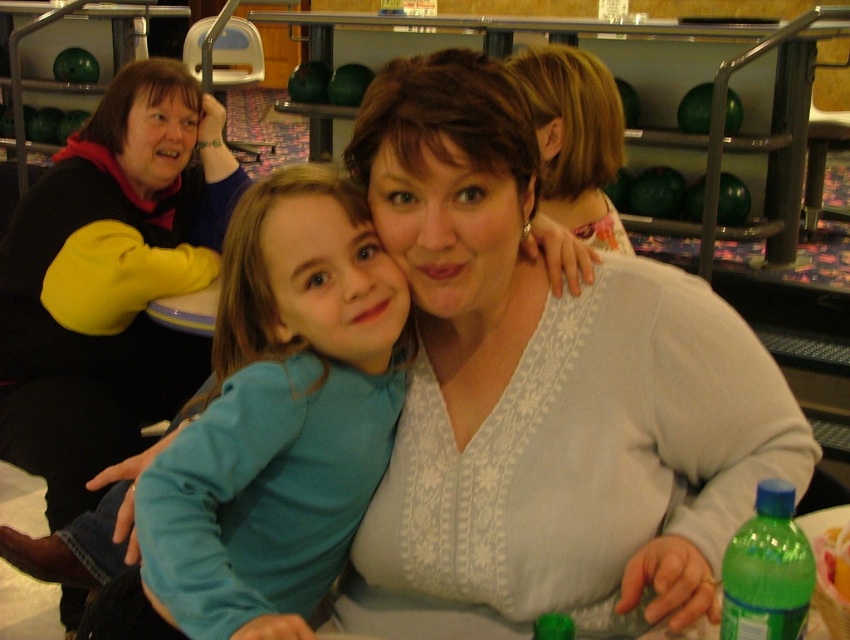
You are a photographer trying to capture a candid shot of the light brown hair at upper center without including the white lace sweater at center in the frame. Is it possible to adjust your camera angle to achieve this?

The white lace sweater at center is to the left of the light brown hair at upper center, so by angling the camera slightly to the right, you can exclude the white lace sweater at center while keeping the light brown hair at upper center in the frame.

You are a photographer setting up for a group photo. You notice the white lace sweater at center and the teal fabric shirt at center. Which of these two items should you adjust your camera focus on if you want to capture the larger object clearly?

The white lace sweater at center is larger in size than the teal fabric shirt at center, so you should adjust your camera focus on the white lace sweater at center to capture the larger object clearly.

You are a photographer trying to capture a candid shot of the light brown hair at upper center and the white lace sweater at center. Since you want to ensure both are in focus, which one should you focus on first to maintain sharpness given their positions?

The white lace sweater at center is located below light brown hair at upper center. To ensure both are in focus, you should focus on the light brown hair at upper center first as it is closer to the camera, allowing the sweater below to stay sharp in the depth of field.